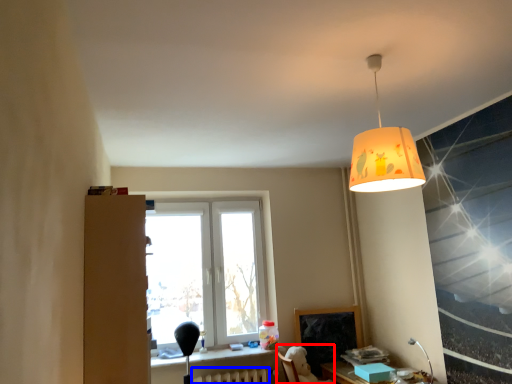
Question: Which object appears closest to the camera in this image, swivel chair (highlighted by a red box) or radiator (highlighted by a blue box)?

Choices:
 (A) swivel chair
 (B) radiator

Answer: (A)